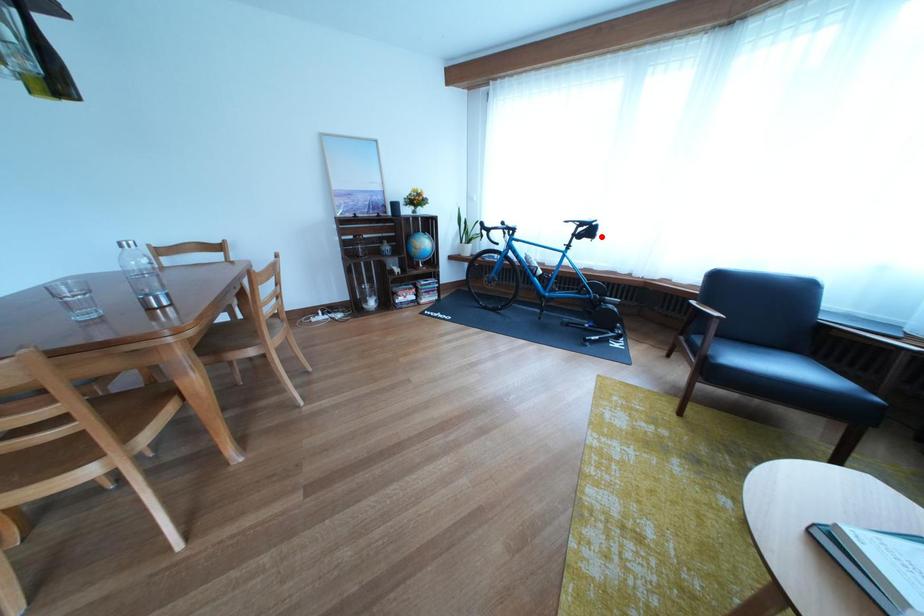
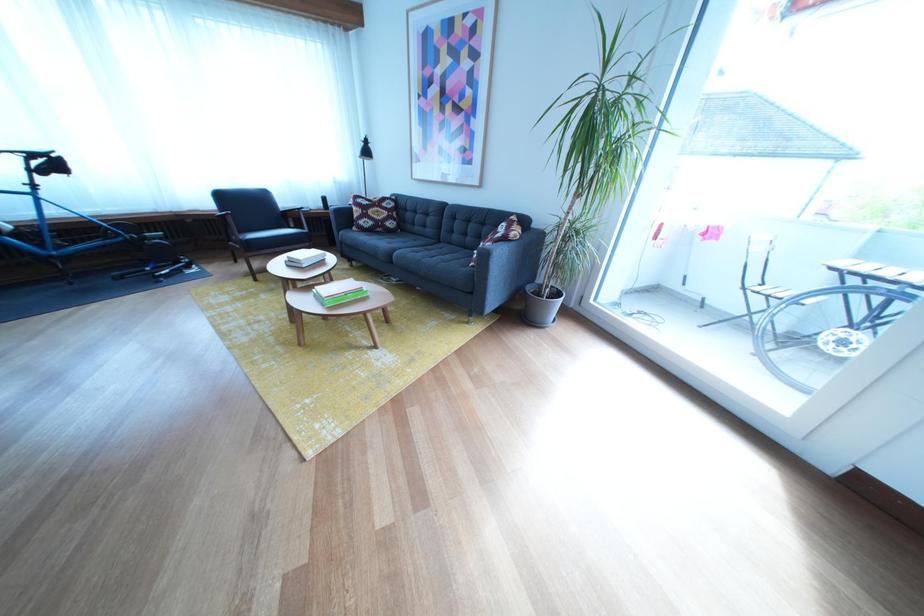
Question: I am providing you with two images of the same scene from different viewpoints. A red point is marked on the first image. Can you still see the location of the red point in image 2?

Choices:
 (A) Yes
 (B) No

Answer: (A)